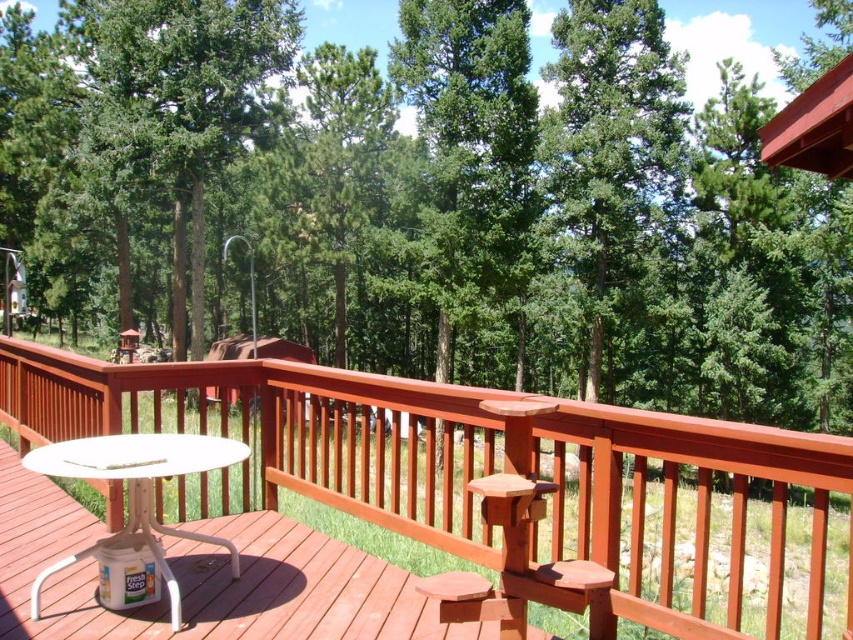
Question: Considering the relative positions of smooth wood balcony at center and white plastic table at center in the image provided, where is smooth wood balcony at center located with respect to white plastic table at center?

Choices:
 (A) below
 (B) above

Answer: (A)

Question: Which object appears farthest from the camera in this image?

Choices:
 (A) white plastic table at center
 (B) white plastic table at lower left

Answer: (A)

Question: Is white plastic table at center positioned behind white plastic table at lower left?

Choices:
 (A) yes
 (B) no

Answer: (A)

Question: Is smooth wood balcony at center to the right of white plastic table at center from the viewer's perspective?

Choices:
 (A) no
 (B) yes

Answer: (B)

Question: Which of the following is the closest to the observer?

Choices:
 (A) (566, 412)
 (B) (85, 460)

Answer: (A)

Question: Which object is positioned closest to the white plastic table at lower left?

Choices:
 (A) smooth wood balcony at center
 (B) white plastic table at center

Answer: (B)